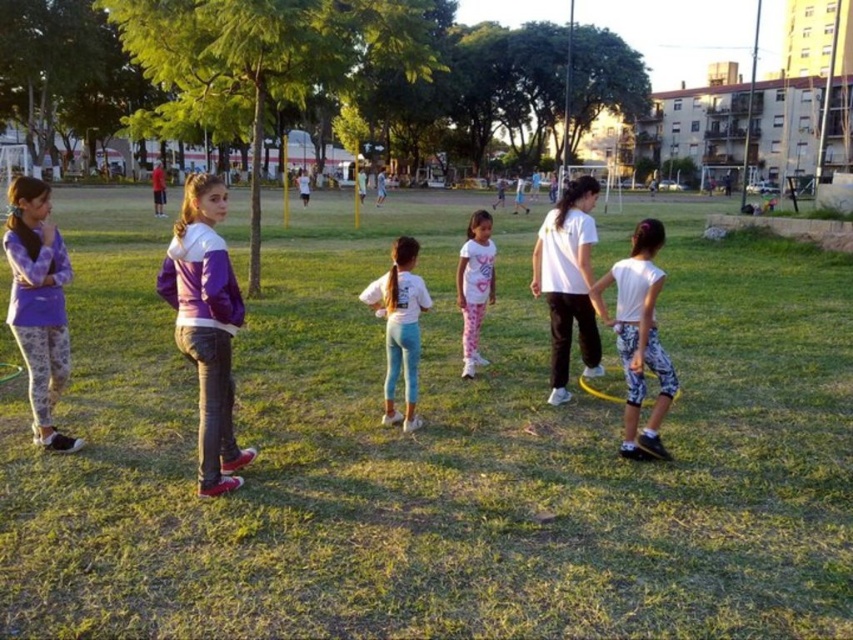
Question: Can you confirm if green grass at center is thinner than white matte leggings at center?

Choices:
 (A) yes
 (B) no

Answer: (B)

Question: Considering the real-world distances, which object is farthest from the white matte hula hoop at center?

Choices:
 (A) green grass at center
 (B) white printed leggings at center
 (C) purple fleece jacket at left
 (D) purple matte jacket at center

Answer: (A)

Question: Can you confirm if green grass at center is wider than white matte leggings at center?

Choices:
 (A) yes
 (B) no

Answer: (A)

Question: Which point is farther to the camera?

Choices:
 (A) green grass at center
 (B) purple matte jacket at center

Answer: (B)

Question: Which object is farther from the camera taking this photo?

Choices:
 (A) white printed leggings at center
 (B) purple matte jacket at center
 (C) purple fleece jacket at left

Answer: (A)

Question: Is green grass at center in front of white printed leggings at center?

Choices:
 (A) no
 (B) yes

Answer: (B)